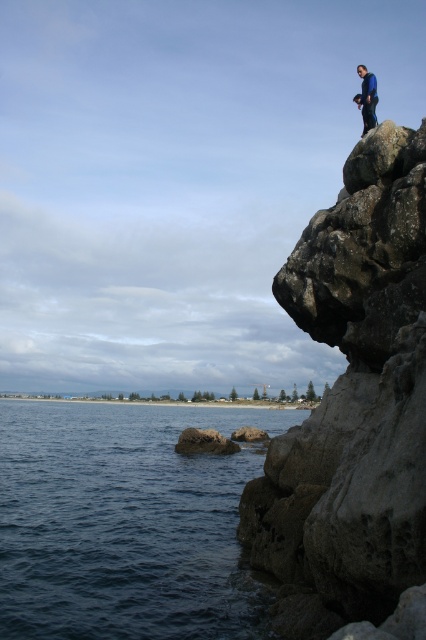
You are standing on the rocky cliff at upper right and want to get to the dark blue water at lower left. Which direction should you move in to reach it?

You should move to the left to reach the dark blue water at lower left since the rocky cliff at upper right is to the right of it.